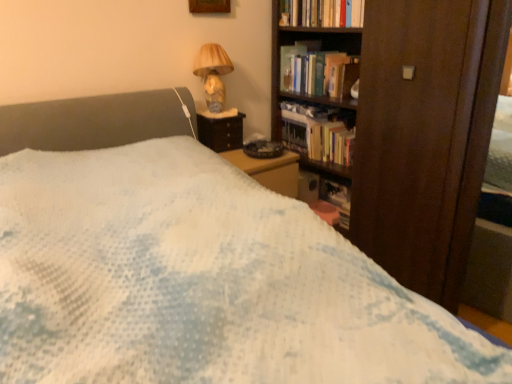
Find the location of a particular element. This screenshot has height=384, width=512. hardcover books at upper center, arranged as the fourth book when ordered from the bottom is located at coordinates (323, 13).

Where is `wooden picture frame at upper center`? The image size is (512, 384). wooden picture frame at upper center is located at coordinates (209, 6).

What do you see at coordinates (289, 64) in the screenshot? Image resolution: width=512 pixels, height=384 pixels. I see `hardcover book at upper right` at bounding box center [289, 64].

Image resolution: width=512 pixels, height=384 pixels. I want to click on wooden nightstand at upper right, so click(x=221, y=132).

Which is less distant, (308,74) or (293,53)?

Point (308,74) is closer to the camera than point (293,53).

Is hardcover books at center, the 2th book positioned from the top, looking in the opposite direction of hardcover book at upper right?

No.

From the image's perspective, is hardcover books at center, which appears as the 3th book when ordered from the bottom, over hardcover book at upper right?

No, from the image's perspective, hardcover books at center, which appears as the 3th book when ordered from the bottom, is not above hardcover book at upper right.

From a real-world perspective, is wooden nightstand at upper right over hardcover books at center, placed as the first book when sorted from bottom to top?

Yes.

From the image's perspective, which is below, wooden nightstand at upper right or hardcover books at center, placed as the first book when sorted from bottom to top?

hardcover books at center, placed as the first book when sorted from bottom to top, from the image's perspective.

Locate an element on the screen. nightstand on the left of hardcover books at center, placed as the first book when sorted from bottom to top is located at coordinates (221, 132).

How far apart are wooden nightstand at upper right and hardcover books at center, the fourth book from the top?

wooden nightstand at upper right is 21.00 inches from hardcover books at center, the fourth book from the top.

At what (x,y) coordinates should I click in order to perform the action: click on nightstand below the wooden picture frame at upper center (from the image's perspective). Please return your answer as a coordinate pair (x, y). This screenshot has height=384, width=512. Looking at the image, I should click on (221, 132).

Considering the points (242, 130) and (201, 2), which point is in front, point (242, 130) or point (201, 2)?

The point (201, 2) is more forward.

Which object is thinner, wooden nightstand at upper right or wooden picture frame at upper center?

wooden picture frame at upper center.

Between wooden nightstand at upper right and wooden picture frame at upper center, which one is positioned behind?

wooden nightstand at upper right is further from the camera.

Is wooden picture frame at upper center inside or outside of hardcover books at upper center, acting as the 1th book starting from the top?

wooden picture frame at upper center is located beyond the bounds of hardcover books at upper center, acting as the 1th book starting from the top.

Can you confirm if wooden picture frame at upper center is shorter than hardcover books at upper center, acting as the 1th book starting from the top?

No.

From the image's perspective, is wooden picture frame at upper center below hardcover books at upper center, arranged as the fourth book when ordered from the bottom?

No.

Is wooden picture frame at upper center oriented away from hardcover books at upper center, acting as the 1th book starting from the top?

No.

Is hardcover books at center, placed as the first book when sorted from bottom to top, positioned with its back to hardcover book at center, positioned as the 3th book in top-to-bottom order?

hardcover books at center, placed as the first book when sorted from bottom to top, does not have its back to hardcover book at center, positioned as the 3th book in top-to-bottom order.

How different are the orientations of hardcover books at center, the fourth book from the top, and hardcover book at center, positioned as the 3th book in top-to-bottom order, in degrees?

The angle between the facing direction of hardcover books at center, the fourth book from the top, and the facing direction of hardcover book at center, positioned as the 3th book in top-to-bottom order, is 0.000432 degrees.

Considering the sizes of objects hardcover books at center, the fourth book from the top, and hardcover book at center, positioned as the 3th book in top-to-bottom order, in the image provided, who is wider, hardcover books at center, the fourth book from the top, or hardcover book at center, positioned as the 3th book in top-to-bottom order,?

hardcover book at center, positioned as the 3th book in top-to-bottom order.

Does hardcover books at center, the fourth book from the top, have a lesser height compared to hardcover book at center, positioned as the 3th book in top-to-bottom order?

Correct, hardcover books at center, the fourth book from the top, is not as tall as hardcover book at center, positioned as the 3th book in top-to-bottom order.

Is hardcover books at center, placed as the first book when sorted from bottom to top, aimed at wooden nightstand at upper right?

No, hardcover books at center, placed as the first book when sorted from bottom to top, is not aimed at wooden nightstand at upper right.

Can you see hardcover books at center, the fourth book from the top, touching wooden nightstand at upper right?

No, hardcover books at center, the fourth book from the top, is not making contact with wooden nightstand at upper right.

Consider the image. What's the angular difference between hardcover books at center, placed as the first book when sorted from bottom to top, and wooden nightstand at upper right's facing directions?

87.6 degrees.

Considering the relative sizes of hardcover books at center, placed as the first book when sorted from bottom to top, and wooden nightstand at upper right in the image provided, is hardcover books at center, placed as the first book when sorted from bottom to top, smaller than wooden nightstand at upper right?

Indeed, hardcover books at center, placed as the first book when sorted from bottom to top, has a smaller size compared to wooden nightstand at upper right.

Is hardcover books at center, the 2th book positioned from the top, wider than matte glass table lamp at upper right?

In fact, hardcover books at center, the 2th book positioned from the top, might be narrower than matte glass table lamp at upper right.

Which point is more distant from viewer, (343, 70) or (210, 70)?

Positioned behind is point (343, 70).

From the image's perspective, is hardcover books at center, the 2th book positioned from the top, located above matte glass table lamp at upper right?

Correct, hardcover books at center, the 2th book positioned from the top, appears higher than matte glass table lamp at upper right in the image.

Based on the photo, is hardcover books at center, the 2th book positioned from the top, to the left of matte glass table lamp at upper right from the viewer's perspective?

No.

I want to click on paperback book located on the left of hardcover books at center, the 2th book positioned from the top, so click(x=289, y=64).

Find the location of a particular element. the 2nd book behind the wooden nightstand at upper right, starting your count from the anchor is located at coordinates (331, 143).

Considering their positions, is hardcover books at center, which appears as the 3th book when ordered from the bottom, positioned further to dark brown wooden bookcase at right than wooden picture frame at upper center?

wooden picture frame at upper center is positioned further to the anchor dark brown wooden bookcase at right.

Considering their positions, is hardcover book at upper right positioned closer to wooden nightstand at upper right than hardcover book at center, the 2th book positioned from the bottom?

Among the two, hardcover book at center, the 2th book positioned from the bottom, is located nearer to wooden nightstand at upper right.

When comparing their distances from hardcover book at center, positioned as the 3th book in top-to-bottom order, does wooden picture frame at upper center or hardcover books at upper center, arranged as the fourth book when ordered from the bottom, seem further?

Among the two, wooden picture frame at upper center is located further to hardcover book at center, positioned as the 3th book in top-to-bottom order.

From the image, which object appears to be nearer to hardcover books at center, the 2th book positioned from the top, hardcover books at center, the fourth book from the top, or hardcover book at upper right?

The object closer to hardcover books at center, the 2th book positioned from the top, is hardcover book at upper right.

When comparing their distances from hardcover books at center, placed as the first book when sorted from bottom to top, does matte glass table lamp at upper right or wooden picture frame at upper center seem closer?

matte glass table lamp at upper right lies closer to hardcover books at center, placed as the first book when sorted from bottom to top, than the other object.

From the image, which object appears to be nearer to hardcover book at upper right, matte glass table lamp at upper right or wooden picture frame at upper center?

Based on the image, matte glass table lamp at upper right appears to be nearer to hardcover book at upper right.

Which object lies further to the anchor point hardcover book at upper right, hardcover books at center, the 2th book positioned from the top, or dark brown wooden bookcase at right?

dark brown wooden bookcase at right is positioned further to the anchor hardcover book at upper right.

Which object lies nearer to the anchor point wooden picture frame at upper center, dark brown wooden bookcase at right or hardcover book at center, positioned as the 3th book in top-to-bottom order?

hardcover book at center, positioned as the 3th book in top-to-bottom order, is positioned closer to the anchor wooden picture frame at upper center.

The image size is (512, 384). I want to click on picture frame positioned between dark brown wooden bookcase at right and matte glass table lamp at upper right from near to far, so click(x=209, y=6).

At what (x,y) coordinates should I click in order to perform the action: click on nightstand between dark brown wooden bookcase at right and hardcover book at center, the 2th book positioned from the bottom, from front to back. Please return your answer as a coordinate pair (x, y). This screenshot has height=384, width=512. Looking at the image, I should click on (221, 132).

Identify the location of nightstand located between matte glass table lamp at upper right and hardcover book at center, positioned as the 3th book in top-to-bottom order, in the left-right direction. The height and width of the screenshot is (384, 512). (221, 132).

Locate an element on the screen. This screenshot has height=384, width=512. picture frame between dark brown wooden bookcase at right and hardcover books at center, the fourth book from the top, along the z-axis is located at coordinates (209, 6).